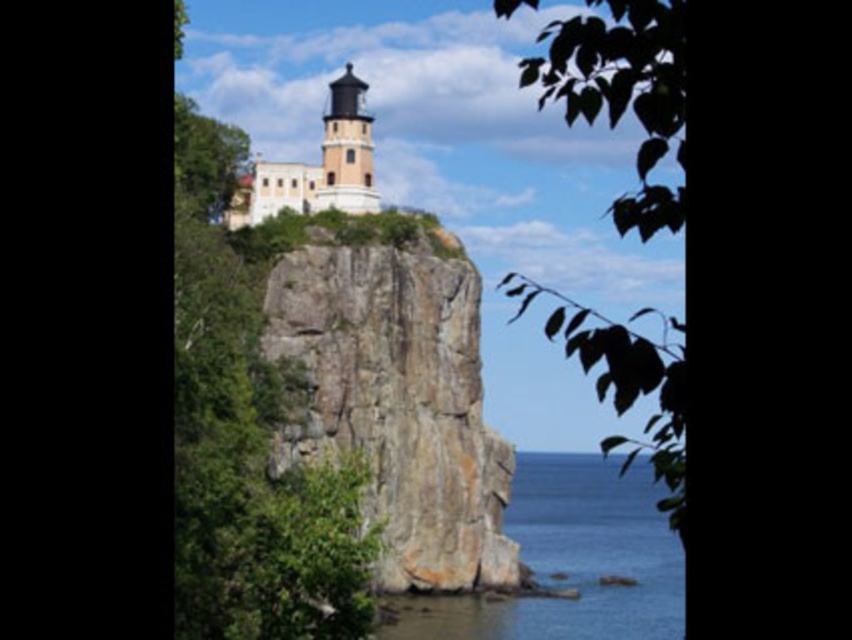
Question: Which point is farther to the camera?

Choices:
 (A) (390, 596)
 (B) (229, 248)
 (C) (622, 369)

Answer: (A)

Question: Can you confirm if white stone tower at upper center is positioned above white textured lighthouse at center?

Choices:
 (A) yes
 (B) no

Answer: (B)

Question: Can you confirm if rocky cliff at center is positioned to the left of white textured lighthouse at center?

Choices:
 (A) yes
 (B) no

Answer: (B)

Question: Does green leafy tree at upper center appear over white textured lighthouse at center?

Choices:
 (A) no
 (B) yes

Answer: (A)

Question: Which object is the farthest from the green leafy tree at upper center?

Choices:
 (A) rocky cliff at center
 (B) green leafy tree at upper left
 (C) clear blue water at center
 (D) white textured lighthouse at center

Answer: (B)

Question: Which is farther from the rocky cliff at center?

Choices:
 (A) green leafy tree at upper left
 (B) clear blue water at center
 (C) green leafy tree at upper center
 (D) white stone tower at upper center

Answer: (C)